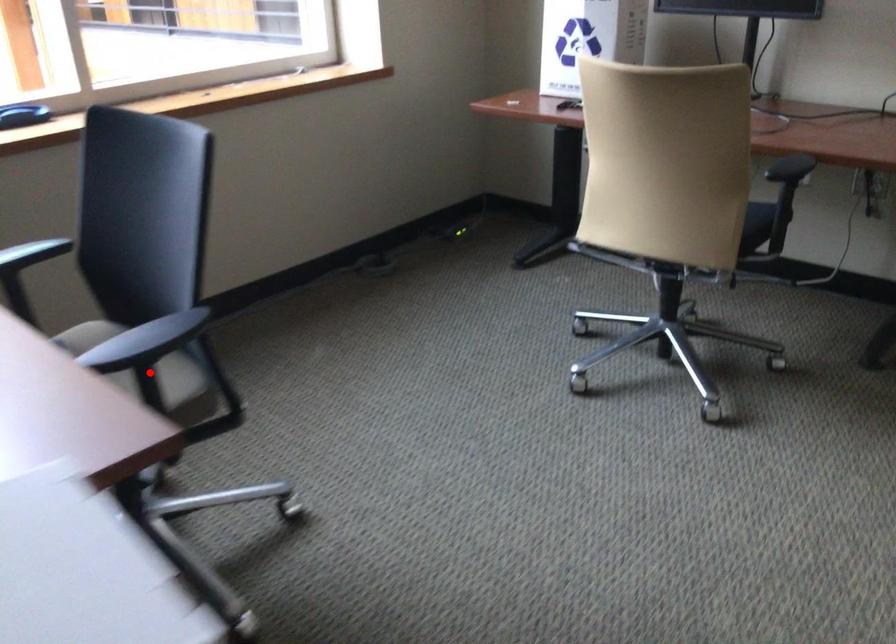
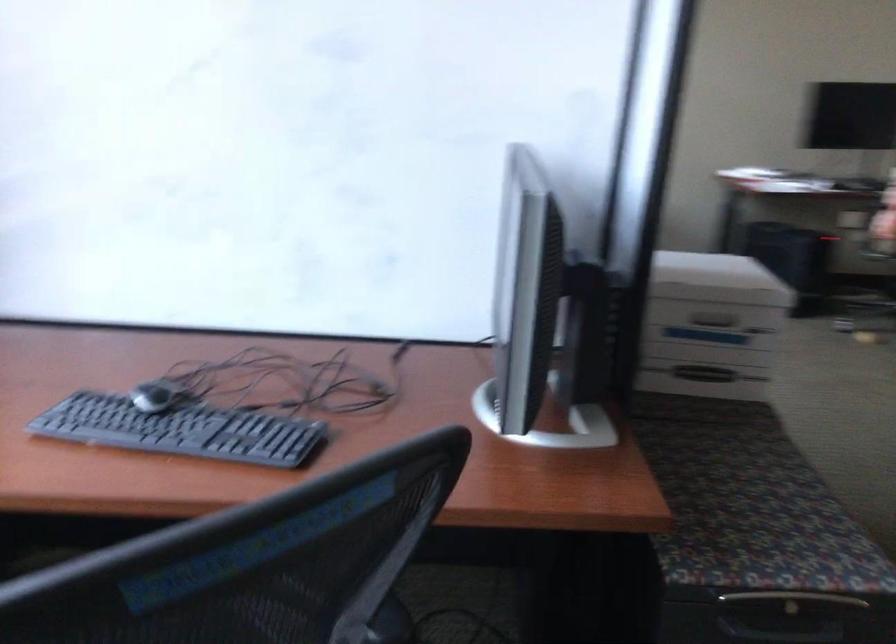
Question: I am providing you with two images of the same scene from different viewpoints. A red point is marked on the first image. Can you still see the location of the red point in image 2?

Choices:
 (A) Yes
 (B) No

Answer: (B)